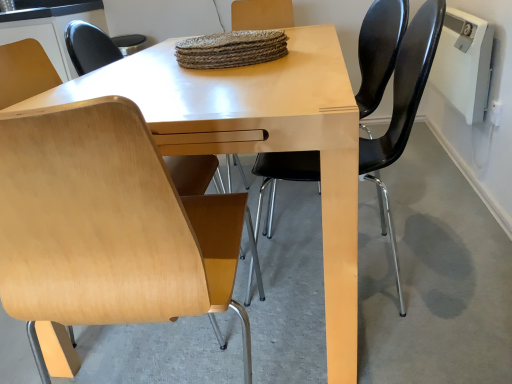
This screenshot has width=512, height=384. Find the location of `free location to the left of black leather chair at right, which appears as the first chair when viewed from the right`. free location to the left of black leather chair at right, which appears as the first chair when viewed from the right is located at coordinates (255, 288).